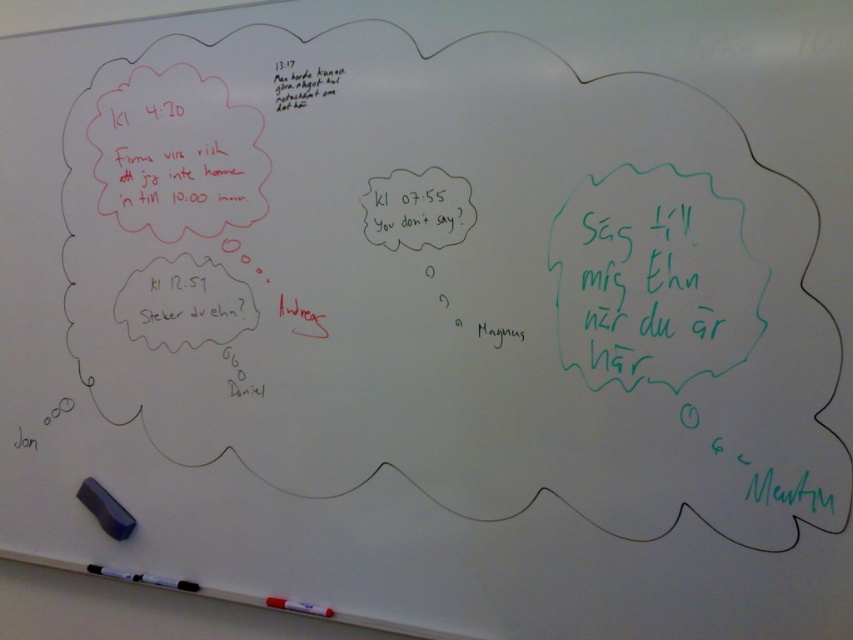
You are organizing the markers on the whiteboard and notice two white matte markers. Which one is closer to you, the white matte marker at lower left or the white matte marker at lower center?

The white matte marker at lower left is closer to you because it is in front of the white matte marker at lower center.